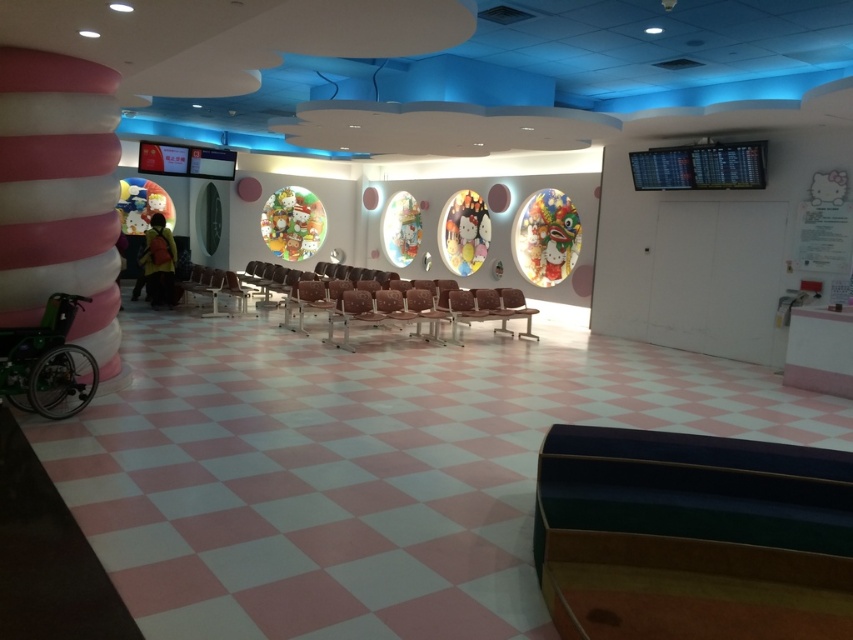
Question: Does dark green leather armchair at center come in front of green plastic wheelchair at lower left?

Choices:
 (A) no
 (B) yes

Answer: (B)

Question: From the image, what is the correct spatial relationship of dark green leather armchair at center in relation to green plastic wheelchair at lower left?

Choices:
 (A) right
 (B) left

Answer: (A)

Question: Which point appears farthest from the camera in this image?

Choices:
 (A) (715, 566)
 (B) (15, 403)

Answer: (B)

Question: Can you confirm if dark green leather armchair at center is positioned above green plastic wheelchair at lower left?

Choices:
 (A) yes
 (B) no

Answer: (B)